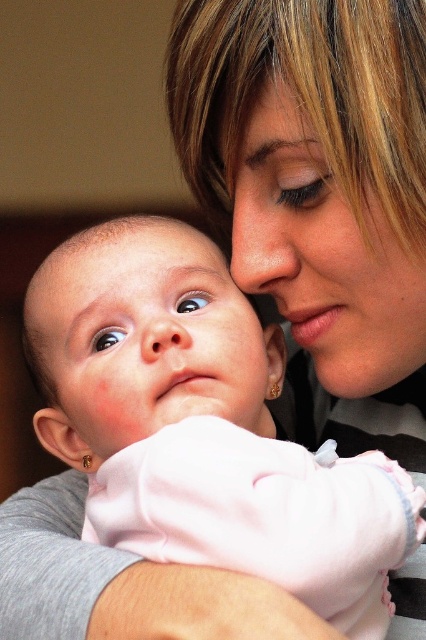
Question: Which point is farther to the camera?

Choices:
 (A) pink fabric at center
 (B) pink fabric baby at center

Answer: (B)

Question: Which point is closer to the camera?

Choices:
 (A) pink fabric baby at center
 (B) pink fabric at center

Answer: (B)

Question: Does pink fabric baby at center appear on the left side of pink fabric at center?

Choices:
 (A) yes
 (B) no

Answer: (B)

Question: Can you confirm if pink fabric baby at center is positioned to the right of pink fabric at center?

Choices:
 (A) no
 (B) yes

Answer: (B)

Question: Can you confirm if pink fabric baby at center is smaller than pink fabric at center?

Choices:
 (A) no
 (B) yes

Answer: (A)